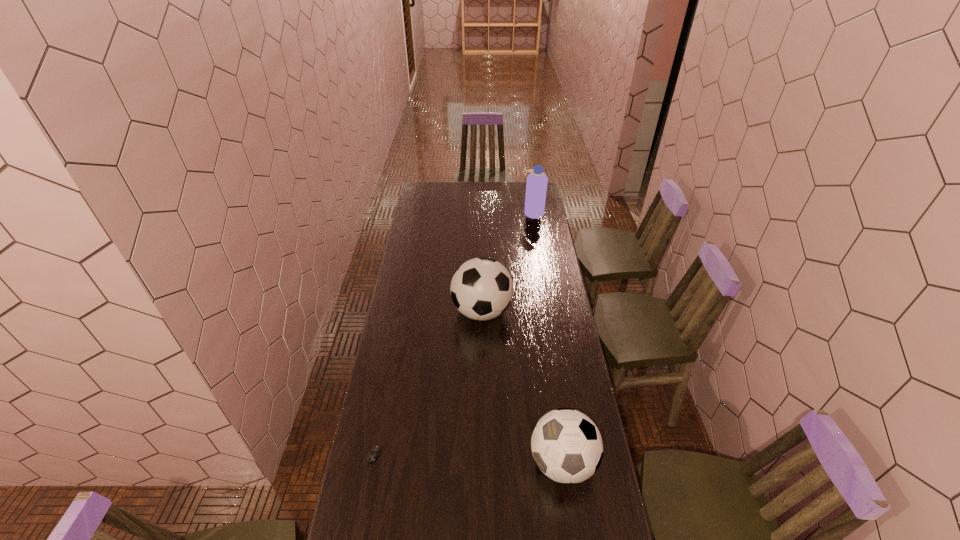
This screenshot has height=540, width=960. In order to click on free space located 0.100m on the main logo of the shorter soccer ball in this screenshot , I will do tap(500, 462).

This screenshot has width=960, height=540. What are the coordinates of `free space located on the main logo of the shorter soccer ball` in the screenshot? It's located at (474, 462).

Where is `vacant point located on the back of the shortest object`? The width and height of the screenshot is (960, 540). vacant point located on the back of the shortest object is located at coordinates (379, 425).

At what (x,y) coordinates should I click in order to perform the action: click on object that is at the left edge. Please return your answer as a coordinate pair (x, y). The width and height of the screenshot is (960, 540). Looking at the image, I should click on (375, 451).

Identify the location of shampoo at the right edge. (536, 186).

This screenshot has height=540, width=960. What are the coordinates of `soccer ball that is at the right edge` in the screenshot? It's located at pyautogui.click(x=566, y=445).

This screenshot has width=960, height=540. In the image, there is a desktop. In order to click on vacant space at the left edge in this screenshot , I will do `click(427, 201)`.

Identify the location of free space at the right edge. (597, 477).

Locate an element on the screen. free spot at the far left corner of the desktop is located at coordinates (431, 190).

What are the coordinates of `empty space between the third tallest object and the shampoo` in the screenshot? It's located at (548, 338).